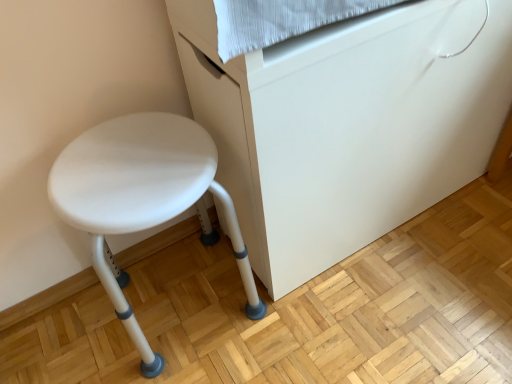
The image size is (512, 384). Find the location of `vacant position to the left of white plastic stool at left`. vacant position to the left of white plastic stool at left is located at coordinates (75, 339).